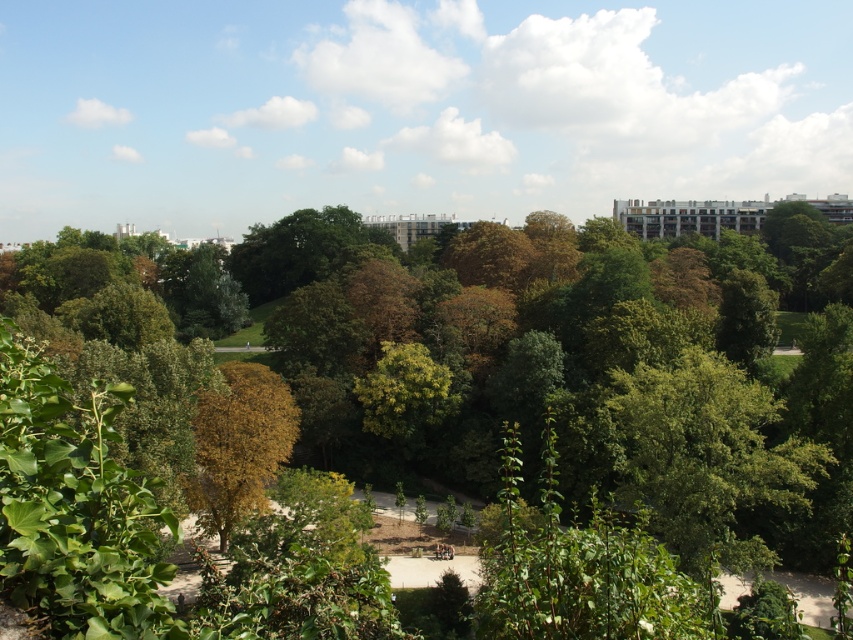
Does green leafy park at center have a lesser height compared to brown leafy tree at center?

No, green leafy park at center is not shorter than brown leafy tree at center.

Which is behind, point (625, 284) or point (283, 394)?

The point (625, 284) is more distant.

Locate an element on the screen. The image size is (853, 640). green leafy park at center is located at coordinates (584, 365).

Where is `green leafy park at center`? Image resolution: width=853 pixels, height=640 pixels. green leafy park at center is located at coordinates (584, 365).